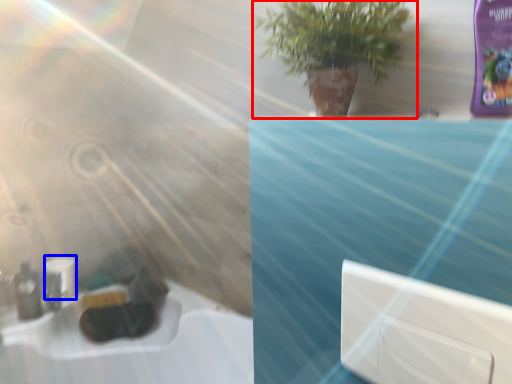
Question: Which object is further to the camera taking this photo, houseplant (highlighted by a red box) or toilet paper (highlighted by a blue box)?

Choices:
 (A) houseplant
 (B) toilet paper

Answer: (B)